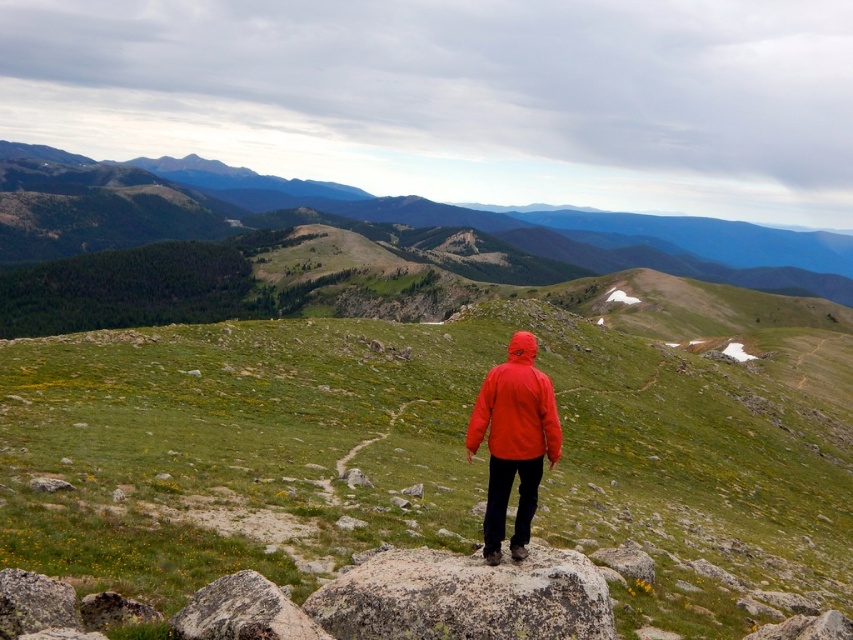
You are a hiker who wants to take a photo of the green grassy hillside at center and the green grassy hill at upper center. Which one will appear larger in your photo?

The green grassy hill at upper center will appear larger in the photo because it is bigger than the green grassy hillside at center.

You are a hiker who wants to take a photo of the green grassy hill at upper center and the green grassy hillside at center. Which hill should you position yourself to the left of to capture both in the frame?

You should position yourself to the left of the green grassy hill at upper center so that the green grassy hillside at center, which is to the right of it, will also be in the frame.